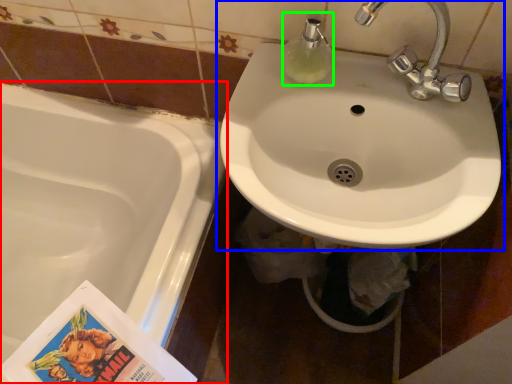
Question: Based on their relative distances, which object is nearer to bathtub (highlighted by a red box)? Choose from sink (highlighted by a blue box) and soap dispenser (highlighted by a green box).

Choices:
 (A) sink
 (B) soap dispenser

Answer: (A)